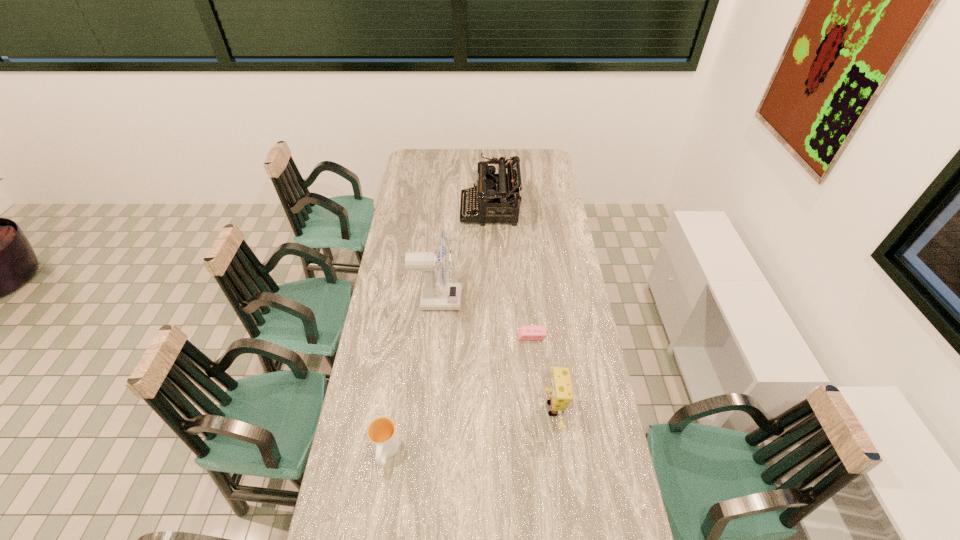
Locate an element on the screen. free space at the left edge of the desktop is located at coordinates (368, 405).

In the image, there is a desktop. What are the coordinates of `vacant region at the right edge` in the screenshot? It's located at (550, 271).

The image size is (960, 540). In order to click on free space at the far left corner of the desktop in this screenshot , I will do `click(420, 164)`.

Locate an element on the screen. Image resolution: width=960 pixels, height=540 pixels. free space between the third shortest object and the tallest object is located at coordinates (495, 354).

Identify the location of empty space between the third tallest object and the fan. (495, 354).

Locate an element on the screen. empty space that is in between the farthest object and the shortest object is located at coordinates (511, 273).

Identify the location of vacant space that's between the cup and the fourth shortest object. The image size is (960, 540). (438, 331).

The image size is (960, 540). Find the location of `empty space between the shortest object and the typewriter`. empty space between the shortest object and the typewriter is located at coordinates (511, 273).

Identify the location of free space that is in between the third farthest object and the cup. Image resolution: width=960 pixels, height=540 pixels. (459, 394).

At what (x,y) coordinates should I click in order to perform the action: click on vacant area that lies between the typewriter and the shortest object. Please return your answer as a coordinate pair (x, y). The height and width of the screenshot is (540, 960). Looking at the image, I should click on (511, 273).